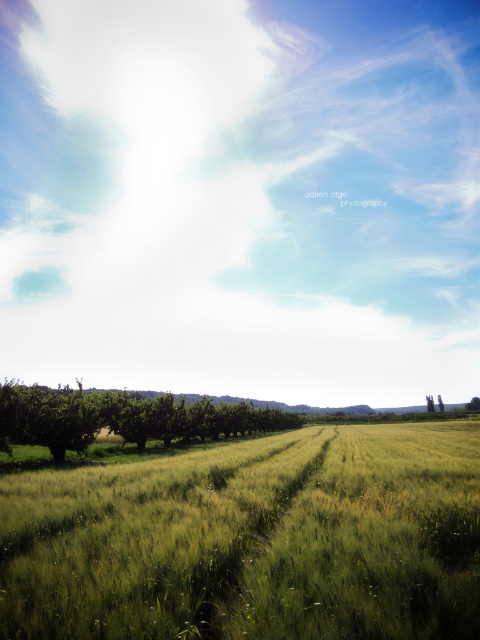
Question: Is green grassy wheat field at lower center above green leafy tree at lower left?

Choices:
 (A) no
 (B) yes

Answer: (B)

Question: Is bright white cloud at upper center closer to camera compared to green grassy wheat field at lower center?

Choices:
 (A) no
 (B) yes

Answer: (A)

Question: Which object is the closest to the green grassy wheat field at lower center?

Choices:
 (A) green leafy tree at lower left
 (B) bright white cloud at upper center

Answer: (A)

Question: Which of the following is the farthest from the observer?

Choices:
 (A) bright white cloud at upper center
 (B) green leafy tree at lower left
 (C) green grassy wheat field at lower center

Answer: (A)

Question: Estimate the real-world distances between objects in this image. Which object is closer to the green leafy tree at lower left?

Choices:
 (A) bright white cloud at upper center
 (B) green grassy wheat field at lower center

Answer: (B)

Question: Does bright white cloud at upper center appear under green leafy tree at lower left?

Choices:
 (A) yes
 (B) no

Answer: (B)